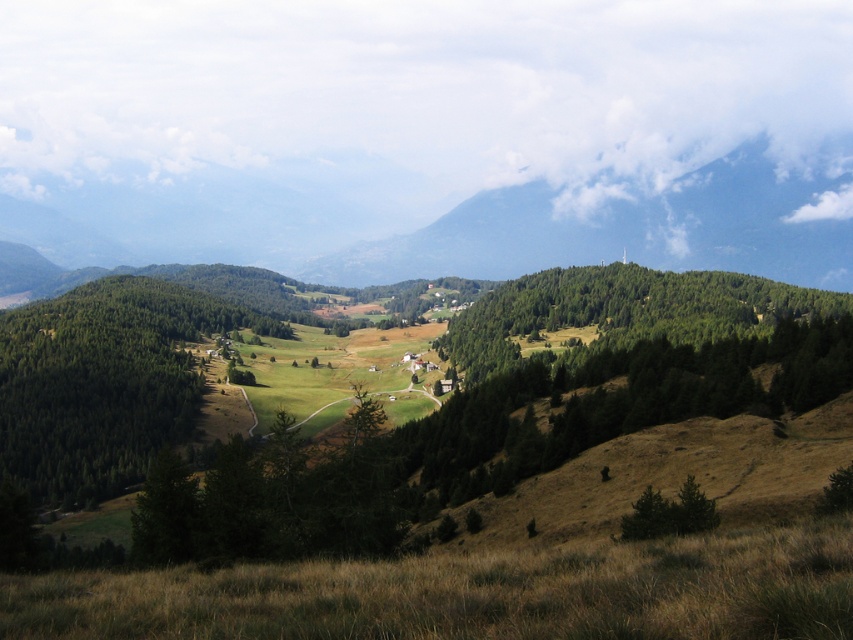
Question: Which of the following is the farthest from the observer?

Choices:
 (A) (57, 401)
 (B) (805, 241)

Answer: (B)

Question: Can you confirm if green matte tree at lower left is wider than green leafy tree at center?

Choices:
 (A) no
 (B) yes

Answer: (A)

Question: Which is nearer to the green matte tree at lower left?

Choices:
 (A) green forested mountain at upper center
 (B) green leafy tree at center

Answer: (B)

Question: Can you confirm if green forested mountain at upper center is bigger than green matte tree at lower left?

Choices:
 (A) no
 (B) yes

Answer: (B)

Question: Which object is the farthest from the green forested mountain at upper center?

Choices:
 (A) green matte tree at lower left
 (B) green leafy tree at center

Answer: (A)

Question: Where is green forested mountain at upper center located in relation to green matte tree at lower left in the image?

Choices:
 (A) left
 (B) right

Answer: (B)